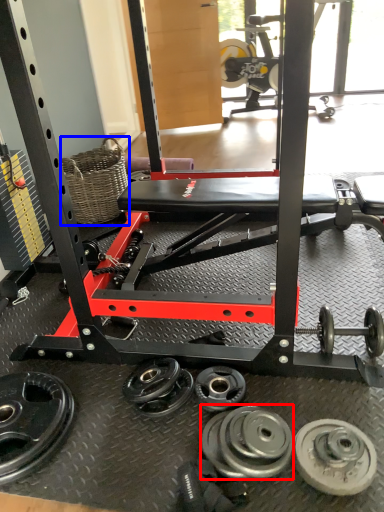
Question: Which object appears closest to the camera in this image, wheel (highlighted by a red box) or basket (highlighted by a blue box)?

Choices:
 (A) wheel
 (B) basket

Answer: (A)